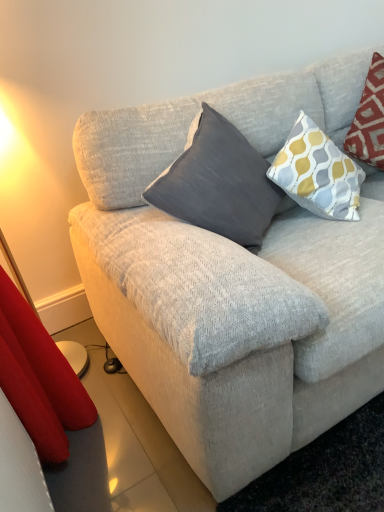
The image size is (384, 512). In order to click on matte gold table lamp at left in this screenshot , I will do `click(40, 203)`.

This screenshot has width=384, height=512. Describe the element at coordinates (40, 203) in the screenshot. I see `matte gold table lamp at left` at that location.

From the picture: What is the approximate width of matte gold table lamp at left?

The width of matte gold table lamp at left is 7.03 inches.

Locate an element on the screen. matte gold table lamp at left is located at coordinates (40, 203).